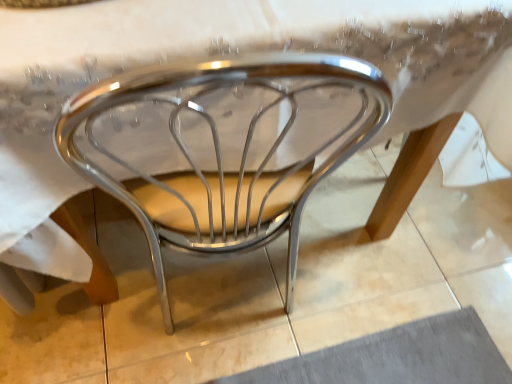
You are a GUI agent. You are given a task and a screenshot of the screen. Output one action in this format:
    pyautogui.click(x=<x>, y=<y>)
    Task: Click on the shiny metallic chair at center
    
    Given the screenshot: What is the action you would take?
    pyautogui.click(x=225, y=146)

Measure the distance between shiny metallic chair at center and camera.

shiny metallic chair at center is 35.92 centimeters from camera.

What do you see at coordinates (225, 146) in the screenshot?
I see `shiny metallic chair at center` at bounding box center [225, 146].

This screenshot has height=384, width=512. I want to click on shiny metallic chair at center, so click(x=225, y=146).